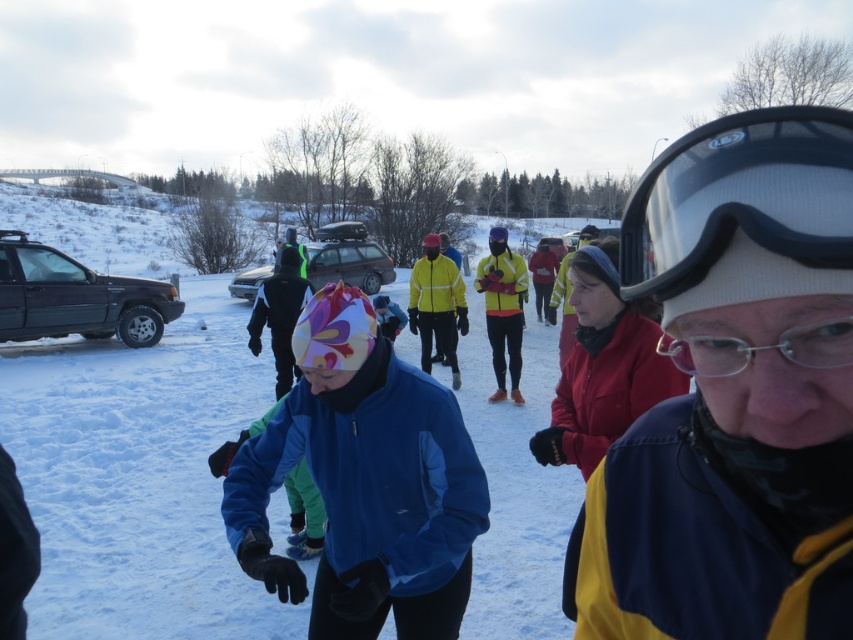
Between yellow and blue jacket at center and blue fleece jacket at center, which one has more height?

Standing taller between the two is blue fleece jacket at center.

Can you confirm if yellow and blue jacket at center is wider than blue fleece jacket at center?

No.

Measure the distance between point (648, 513) and camera.

Point (648, 513) is 3.30 feet from camera.

Where is `yellow and blue jacket at center`? The height and width of the screenshot is (640, 853). yellow and blue jacket at center is located at coordinates (735, 394).

Between white fluffy snow at center and blue fleece jacket at center, which one appears on the right side from the viewer's perspective?

blue fleece jacket at center is more to the right.

Can you confirm if white fluffy snow at center is positioned to the left of blue fleece jacket at center?

Yes, white fluffy snow at center is to the left of blue fleece jacket at center.

Who is more distant from viewer, (x=271, y=632) or (x=251, y=540)?

The point (x=271, y=632) is more distant.

Locate an element on the screen. white fluffy snow at center is located at coordinates (138, 476).

Can you confirm if white fluffy snow at center is shorter than transparent plastic goggles at upper right?

In fact, white fluffy snow at center may be taller than transparent plastic goggles at upper right.

Does point (527, 340) come in front of point (722, 141)?

No, (527, 340) is behind (722, 141).

Identify the location of white fluffy snow at center. This screenshot has width=853, height=640. [138, 476].